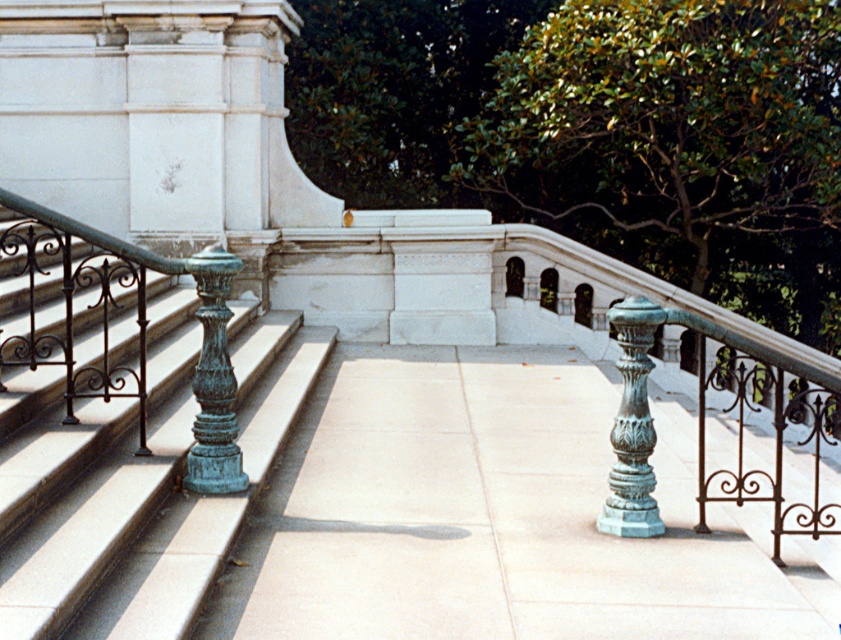
Question: Is green patina metal railing at left below green patina column at center?

Choices:
 (A) no
 (B) yes

Answer: (A)

Question: Which point is farther from the camera taking this photo?

Choices:
 (A) (56, 368)
 (B) (633, 300)
 (C) (199, 419)

Answer: (A)

Question: Does green patina column at center-left have a larger size compared to green patina column at center?

Choices:
 (A) no
 (B) yes

Answer: (A)

Question: Which of the following is the closest to the observer?

Choices:
 (A) (182, 554)
 (B) (615, 452)
 (C) (209, 273)

Answer: (A)

Question: Can you confirm if green patina metal railing at left is thinner than green patina column at center?

Choices:
 (A) yes
 (B) no

Answer: (B)

Question: Which of the following is the farthest from the observer?

Choices:
 (A) green patina metal railing at left
 (B) green patina column at center
 (C) green patina column at center-left

Answer: (C)